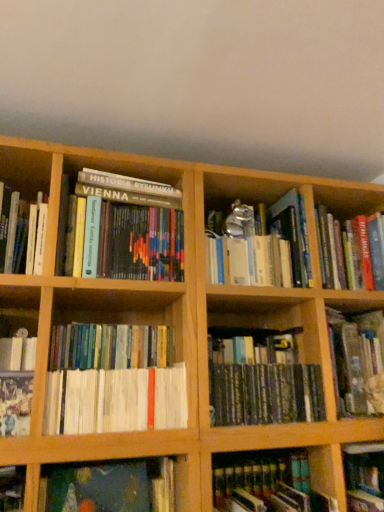
Measure the distance between hardcover book at lower left, positioned as the 9th book in right-to-left order, and camera.

The depth of hardcover book at lower left, positioned as the 9th book in right-to-left order, is 3.38 feet.

At what (x,y) coordinates should I click in order to perform the action: click on hardcover book at lower left, which is counted as the 1th book, starting from the left. Please return your answer as a coordinate pair (x, y). The height and width of the screenshot is (512, 384). Looking at the image, I should click on (12, 488).

This screenshot has width=384, height=512. In order to click on hardcover book at center, the third book positioned from the left in this screenshot , I will do `click(120, 229)`.

Measure the distance between point (296, 474) and camera.

Point (296, 474) is 1.24 meters away from camera.

You are a GUI agent. You are given a task and a screenshot of the screen. Output one action in this format:
    pyautogui.click(x=<x>, y=<y>)
    Task: Click on the metallic silver spoon at center, which is the 7th book from left to right
    This screenshot has height=512, width=384.
    Given the screenshot: What is the action you would take?
    (262, 247)

The image size is (384, 512). Describe the element at coordinates (113, 381) in the screenshot. I see `white paperbacks at center, marked as the sixth book in a right-to-left arrangement` at that location.

What are the coordinates of `white paper book at lower left, placed as the eighth book when sorted from right to left` in the screenshot? It's located at 16,383.

From a real-world perspective, is hardcover book at lower right, which is the 2th book from right to left, positioned under hardcover book at center, the 6th book in the left-to-right sequence, based on gravity?

Yes.

Is hardcover book at lower right, which is the 2th book from right to left, outside of hardcover book at center, the 4th book positioned from the right?

Indeed, hardcover book at lower right, which is the 2th book from right to left, is completely outside hardcover book at center, the 4th book positioned from the right.

How distant is hardcover book at lower right, which is the 2th book from right to left, from hardcover book at center, the 6th book in the left-to-right sequence?

hardcover book at lower right, which is the 2th book from right to left, is 22.58 centimeters away from hardcover book at center, the 6th book in the left-to-right sequence.

Does hardcover book at lower right, which is the 2th book from right to left, appear on the right side of hardcover book at center, the 4th book positioned from the right?

Yes, hardcover book at lower right, which is the 2th book from right to left, is to the right of hardcover book at center, the 4th book positioned from the right.

Find the location of a particular element. This screenshot has width=384, height=512. the 2nd book below the white paper book at lower left, arranged as the 2th book when viewed from the left (from a real-world perspective) is located at coordinates (110, 487).

Based on the photo, considering the sizes of objects white paper book at lower left, placed as the eighth book when sorted from right to left, and dark green canvas painting at lower left, which is the 5th book in left-to-right order, in the image provided, who is bigger, white paper book at lower left, placed as the eighth book when sorted from right to left, or dark green canvas painting at lower left, which is the 5th book in left-to-right order,?

With larger size is white paper book at lower left, placed as the eighth book when sorted from right to left.

How distant is white paper book at lower left, arranged as the 2th book when viewed from the left, from dark green canvas painting at lower left, which is the 5th book in left-to-right order?

A distance of 10.57 inches exists between white paper book at lower left, arranged as the 2th book when viewed from the left, and dark green canvas painting at lower left, which is the 5th book in left-to-right order.

Is white paper book at lower left, placed as the eighth book when sorted from right to left, not close to dark green canvas painting at lower left, acting as the 5th book starting from the right?

No, white paper book at lower left, placed as the eighth book when sorted from right to left, is not far from dark green canvas painting at lower left, acting as the 5th book starting from the right.

Is dark green canvas painting at lower left, acting as the 5th book starting from the right, taller or shorter than white paperbacks at center, arranged as the 4th book when viewed from the left?

In the image, dark green canvas painting at lower left, acting as the 5th book starting from the right, appears to be shorter than white paperbacks at center, arranged as the 4th book when viewed from the left.

Between dark green canvas painting at lower left, which is the 5th book in left-to-right order, and white paperbacks at center, marked as the sixth book in a right-to-left arrangement, which one has larger size?

white paperbacks at center, marked as the sixth book in a right-to-left arrangement.

Does point (101, 464) appear closer or farther from the camera than point (158, 355)?

Clearly, point (101, 464) is closer to the camera than point (158, 355).

In the scene shown: How far apart are dark green canvas painting at lower left, which is the 5th book in left-to-right order, and white paperbacks at center, arranged as the 4th book when viewed from the left?

dark green canvas painting at lower left, which is the 5th book in left-to-right order, and white paperbacks at center, arranged as the 4th book when viewed from the left, are 8.22 inches apart.

Between white paperbacks at center, marked as the sixth book in a right-to-left arrangement, and white paper book at lower left, placed as the eighth book when sorted from right to left, which one is positioned behind?

white paperbacks at center, marked as the sixth book in a right-to-left arrangement, is more distant.

Considering the points (70, 367) and (24, 423), which point is behind, point (70, 367) or point (24, 423)?

Point (70, 367)

Which of these two, white paperbacks at center, marked as the sixth book in a right-to-left arrangement, or white paper book at lower left, placed as the eighth book when sorted from right to left, is wider?

With larger width is white paper book at lower left, placed as the eighth book when sorted from right to left.

Is white paperbacks at center, arranged as the 4th book when viewed from the left, to the left or to the right of white paper book at lower left, placed as the eighth book when sorted from right to left, in the image?

In the image, white paperbacks at center, arranged as the 4th book when viewed from the left, appears on the right side of white paper book at lower left, placed as the eighth book when sorted from right to left.

This screenshot has height=512, width=384. In order to click on book that is the 4th object located behind the hardcover book at lower left, positioned as the 9th book in right-to-left order in this screenshot , I will do `click(113, 381)`.

From the image's perspective, is white paperbacks at center, arranged as the 4th book when viewed from the left, above hardcover book at lower left, positioned as the 9th book in right-to-left order?

Yes, from the image's perspective, white paperbacks at center, arranged as the 4th book when viewed from the left, is on top of hardcover book at lower left, positioned as the 9th book in right-to-left order.

Is white paperbacks at center, arranged as the 4th book when viewed from the left, turned away from hardcover book at lower left, positioned as the 9th book in right-to-left order?

No, white paperbacks at center, arranged as the 4th book when viewed from the left, is not facing away from hardcover book at lower left, positioned as the 9th book in right-to-left order.

In the scene shown: Is white paperbacks at center, marked as the sixth book in a right-to-left arrangement, spatially inside hardcover book at lower left, positioned as the 9th book in right-to-left order, or outside of it?

white paperbacks at center, marked as the sixth book in a right-to-left arrangement, is outside hardcover book at lower left, positioned as the 9th book in right-to-left order.

Which of these two, hardcover book at center, the third book positioned from the left, or hardcover book at lower right, acting as the 8th book starting from the left, is thinner?

With smaller width is hardcover book at lower right, acting as the 8th book starting from the left.

Is hardcover book at center, which is the 7th book from right to left, touching hardcover book at lower right, acting as the 8th book starting from the left?

hardcover book at center, which is the 7th book from right to left, is not next to hardcover book at lower right, acting as the 8th book starting from the left, and they're not touching.

In the scene shown: From a real-world perspective, is hardcover book at center, which is the 7th book from right to left, located beneath hardcover book at lower right, which is the 2th book from right to left?

Actually, hardcover book at center, which is the 7th book from right to left, is physically above hardcover book at lower right, which is the 2th book from right to left, in the real world.

Which of these two, hardcover book at center, which is the 7th book from right to left, or hardcover book at lower right, acting as the 8th book starting from the left, is bigger?

hardcover book at center, which is the 7th book from right to left, is bigger.

Is hardcover book at center, which is the 7th book from right to left, turned away from white paperbacks at center, arranged as the 4th book when viewed from the left?

No, hardcover book at center, which is the 7th book from right to left, is not facing away from white paperbacks at center, arranged as the 4th book when viewed from the left.

Based on the photo, from a real-world perspective, is hardcover book at center, the third book positioned from the left, over white paperbacks at center, marked as the sixth book in a right-to-left arrangement?

Yes, from a real-world perspective, hardcover book at center, the third book positioned from the left, is on top of white paperbacks at center, marked as the sixth book in a right-to-left arrangement.

Can you confirm if hardcover book at center, which is the 7th book from right to left, is shorter than white paperbacks at center, arranged as the 4th book when viewed from the left?

Yes, hardcover book at center, which is the 7th book from right to left, is shorter than white paperbacks at center, arranged as the 4th book when viewed from the left.

You are a GUI agent. You are given a task and a screenshot of the screen. Output one action in this format:
    pyautogui.click(x=<x>, y=<y>)
    Task: Click on the 1st book counting from the left of the white paperbacks at center, arranged as the 4th book when viewed from the left
    This screenshot has width=384, height=512.
    Given the screenshot: What is the action you would take?
    pyautogui.click(x=120, y=229)

The width and height of the screenshot is (384, 512). What are the coordinates of `book that is the 3rd one when counting forward from the hardcover book at center, the 6th book in the left-to-right sequence` in the screenshot? It's located at (267, 483).

The height and width of the screenshot is (512, 384). Find the location of `book that is the 3rd one when counting rightward from the white paper book at lower left, arranged as the 2th book when viewed from the left`. book that is the 3rd one when counting rightward from the white paper book at lower left, arranged as the 2th book when viewed from the left is located at coordinates (110, 487).

When comparing their distances from hardcover book at center, which is the 7th book from right to left, does white paper book at lower left, arranged as the 2th book when viewed from the left, or hardcover book at center right, which is the first book from right to left, seem closer?

Based on the image, white paper book at lower left, arranged as the 2th book when viewed from the left, appears to be nearer to hardcover book at center, which is the 7th book from right to left.

Estimate the real-world distances between objects in this image. Which object is further from hardcover book at center, which is the 7th book from right to left, hardcover book at center right, which is the first book from right to left, or dark green canvas painting at lower left, acting as the 5th book starting from the right?

hardcover book at center right, which is the first book from right to left, is positioned further to the anchor hardcover book at center, which is the 7th book from right to left.

Estimate the real-world distances between objects in this image. Which object is further from white paper book at lower left, placed as the eighth book when sorted from right to left, wooden bookshelf at upper right or dark green canvas painting at lower left, acting as the 5th book starting from the right?

wooden bookshelf at upper right.

Looking at this image, based on their spatial positions, is hardcover book at center right, which appears as the 9th book when viewed from the left, or white paper book at lower left, placed as the eighth book when sorted from right to left, further from dark green canvas painting at lower left, which is the 5th book in left-to-right order?

The object further to dark green canvas painting at lower left, which is the 5th book in left-to-right order, is hardcover book at center right, which appears as the 9th book when viewed from the left.

Estimate the real-world distances between objects in this image. Which object is further from hardcover book at center, the 6th book in the left-to-right sequence, hardcover book at center right, which appears as the 9th book when viewed from the left, or white paperbacks at center, marked as the sixth book in a right-to-left arrangement?

white paperbacks at center, marked as the sixth book in a right-to-left arrangement, is further to hardcover book at center, the 6th book in the left-to-right sequence.

Looking at the image, which one is located closer to white paper book at lower left, arranged as the 2th book when viewed from the left, hardcover book at lower right, which is the 2th book from right to left, or hardcover book at center, which is the 7th book from right to left?

hardcover book at center, which is the 7th book from right to left, is closer to white paper book at lower left, arranged as the 2th book when viewed from the left.

Estimate the real-world distances between objects in this image. Which object is closer to metallic silver spoon at center, which is the 7th book from left to right, hardcover book at center right, which appears as the 9th book when viewed from the left, or hardcover book at lower right, which is the 2th book from right to left?

hardcover book at center right, which appears as the 9th book when viewed from the left, is positioned closer to the anchor metallic silver spoon at center, which is the 7th book from left to right.

Which object lies further to the anchor point white paperbacks at center, arranged as the 4th book when viewed from the left, dark green canvas painting at lower left, acting as the 5th book starting from the right, or white paper book at lower left, arranged as the 2th book when viewed from the left?

Among the two, dark green canvas painting at lower left, acting as the 5th book starting from the right, is located further to white paperbacks at center, arranged as the 4th book when viewed from the left.

Locate an element on the screen. cabinet between hardcover book at center, the third book positioned from the left, and hardcover book at center right, which is the first book from right to left, in the horizontal direction is located at coordinates (330, 234).

Find the location of a particular element. The image size is (384, 512). cabinet situated between white paper book at lower left, placed as the eighth book when sorted from right to left, and hardcover book at center right, which appears as the 9th book when viewed from the left, from left to right is located at coordinates (330, 234).

Locate an element on the screen. This screenshot has width=384, height=512. book between hardcover book at center, the third book positioned from the left, and white paperbacks at center, marked as the sixth book in a right-to-left arrangement, vertically is located at coordinates (16, 383).

Find the location of a particular element. The image size is (384, 512). cabinet between hardcover book at center, the 4th book positioned from the right, and hardcover book at center right, which appears as the 9th book when viewed from the left, from left to right is located at coordinates (330, 234).